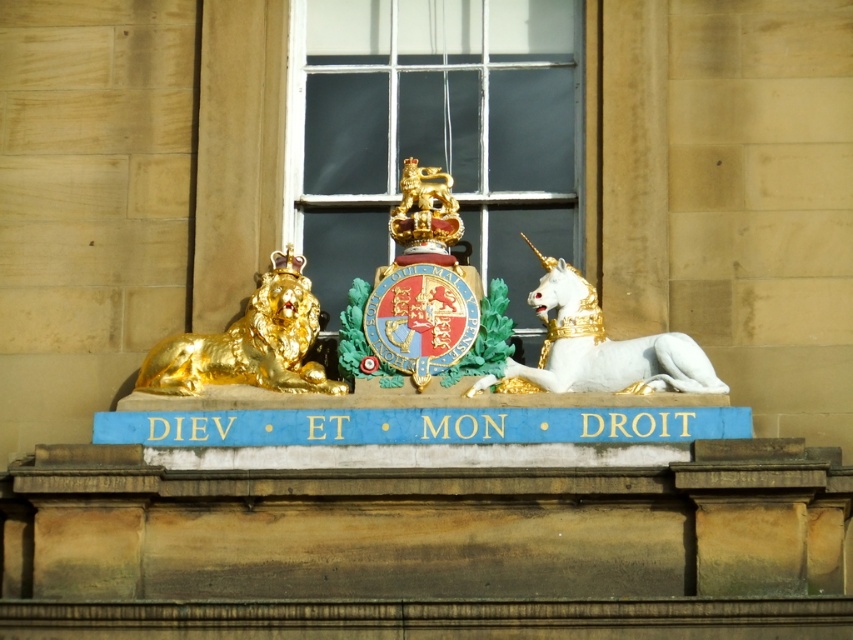
Who is more distant from viewer, (505, 378) or (256, 360)?

Point (256, 360)

The height and width of the screenshot is (640, 853). Describe the element at coordinates (601, 346) in the screenshot. I see `white marble unicorn at center` at that location.

The image size is (853, 640). I want to click on white marble unicorn at center, so click(601, 346).